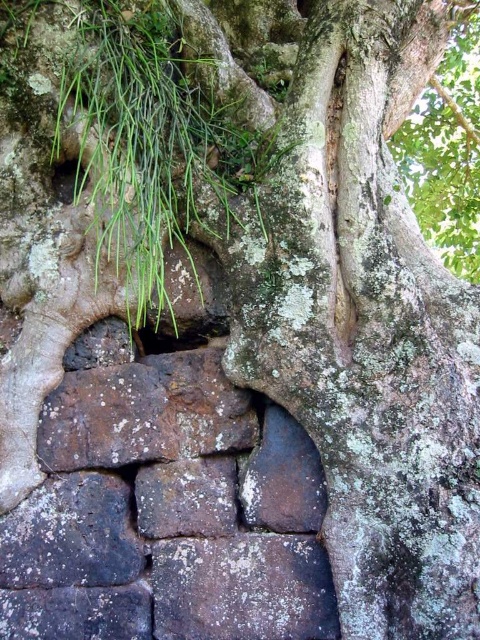
Does rusty metal stone at center have a greater width compared to black stone hole at center?

Yes.

Is rusty metal stone at center further to the viewer compared to black stone hole at center?

No, rusty metal stone at center is closer to the viewer.

Who is more distant from viewer, (199, 467) or (163, 332)?

Point (163, 332)

Identify the location of rusty metal stone at center. The width and height of the screenshot is (480, 640). (187, 497).

Can you confirm if green leafy plant at center is positioned to the right of black stone hole at center?

Yes, green leafy plant at center is to the right of black stone hole at center.

The height and width of the screenshot is (640, 480). What do you see at coordinates (155, 132) in the screenshot?
I see `green leafy plant at center` at bounding box center [155, 132].

Between point (168, 35) and point (178, 333), which one is positioned in front?

Positioned in front is point (168, 35).

The image size is (480, 640). In order to click on green leafy plant at center in this screenshot , I will do `click(155, 132)`.

Between rusty stone at center and gray rough stone at center, which one is positioned higher?

rusty stone at center is higher up.

Which of these two, rusty stone at center or gray rough stone at center, stands taller?

rusty stone at center is taller.

The height and width of the screenshot is (640, 480). Identify the location of rusty stone at center. (144, 413).